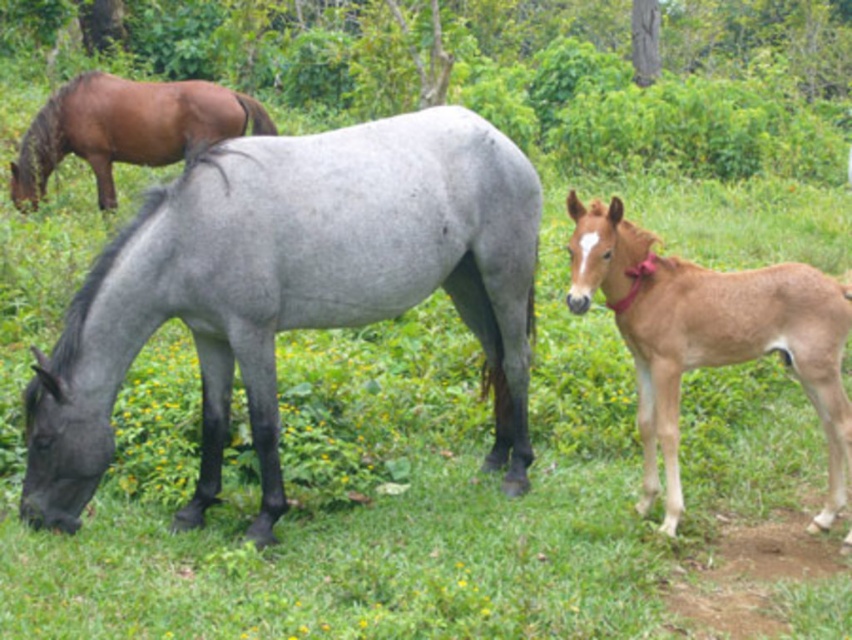
Is point (27, 403) positioned behind point (605, 289)?

That is False.

Can you confirm if gray matte horse at center is wider than brown smooth foal at right?

Yes.

Does point (462, 131) come farther from viewer compared to point (639, 252)?

Yes, it is.

This screenshot has height=640, width=852. What are the coordinates of `gray matte horse at center` in the screenshot? It's located at (292, 289).

How distant is gray matte horse at center from brown glossy horse at upper left?

They are 16.91 feet apart.

Describe the element at coordinates (292, 289) in the screenshot. I see `gray matte horse at center` at that location.

Locate an element on the screen. Image resolution: width=852 pixels, height=640 pixels. gray matte horse at center is located at coordinates (292, 289).

Is brown smooth foal at right shorter than brown glossy horse at upper left?

Incorrect, brown smooth foal at right's height does not fall short of brown glossy horse at upper left's.

Is point (735, 330) closer to camera compared to point (55, 97)?

Yes, it is.

This screenshot has height=640, width=852. Identify the location of brown smooth foal at right. (711, 337).